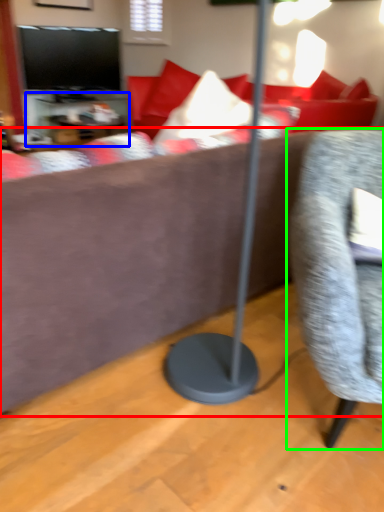
Question: Considering the real-world distances, which object is closest to studio couch (highlighted by a red box)? table (highlighted by a blue box) or chair (highlighted by a green box).

Choices:
 (A) table
 (B) chair

Answer: (B)